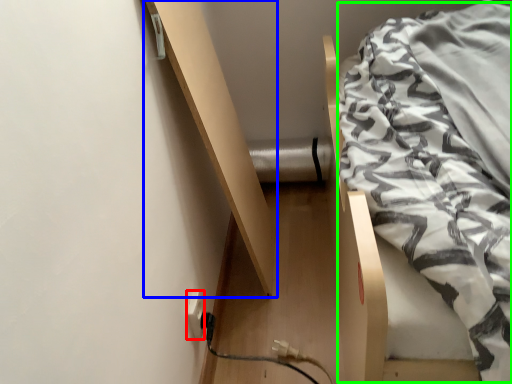
Question: Which object is the farthest from electric outlet (highlighted by a red box)? Choose among these: shelf (highlighted by a blue box) or blanket (highlighted by a green box).

Choices:
 (A) shelf
 (B) blanket

Answer: (B)